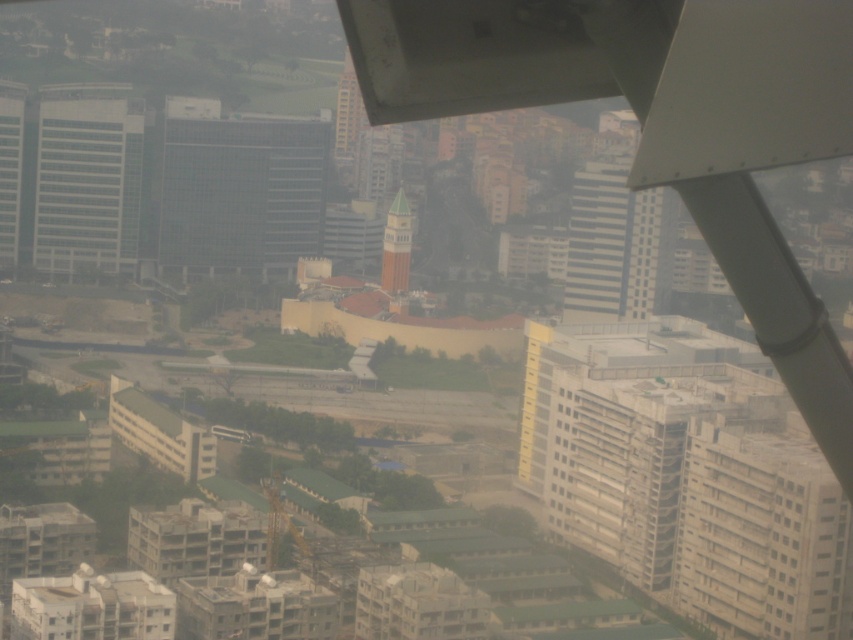
You are a drone operator trying to navigate between the glassy reflective skyscraper at left and the green painted tower at center. According to the scene, which structure is closer to the drone operator?

The green painted tower at center is closer to the drone operator because the glassy reflective skyscraper at left is positioned over it, indicating it is further away.

You are a city planner evaluating the urban layout. Which object, the transparent glass building at center or the glassy gray skyscraper at left, has a greater width when viewed from this elevated perspective?

The transparent glass building at center has a greater width than the glassy gray skyscraper at left.

Based on the scene description and the coordinates provided, which object corresponds to the point labeled as point (10, 170)?

The point (10, 170) marks the glassy reflective skyscraper at left.